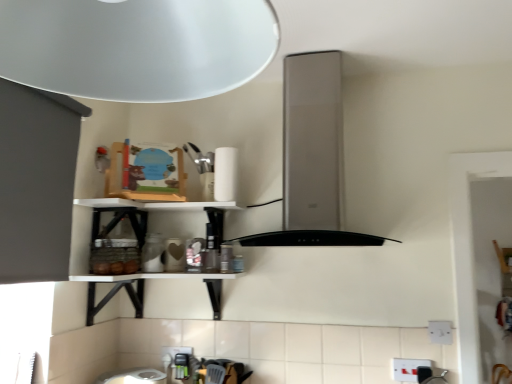
Image resolution: width=512 pixels, height=384 pixels. What do you see at coordinates (407, 368) in the screenshot? I see `white plastic electric outlet at lower right, acting as the second electric outlet starting from the right` at bounding box center [407, 368].

This screenshot has height=384, width=512. Identify the location of white plastic electric outlet at lower center, which is the 3th electric outlet in top-to-bottom order. (175, 352).

Is white matte paper towel at upper center spatially inside white plastic electric outlet at lower right, the 2th electric outlet ordered from the bottom, or outside of it?

white matte paper towel at upper center is located beyond the bounds of white plastic electric outlet at lower right, the 2th electric outlet ordered from the bottom.

Is point (223, 198) positioned before point (398, 363)?

No, it is behind (398, 363).

Based on the photo, considering the relative sizes of white matte paper towel at upper center and white plastic electric outlet at lower right, acting as the second electric outlet starting from the right, in the image provided, is white matte paper towel at upper center shorter than white plastic electric outlet at lower right, acting as the second electric outlet starting from the right,?

In fact, white matte paper towel at upper center may be taller than white plastic electric outlet at lower right, acting as the second electric outlet starting from the right.

From a real-world perspective, is white matte paper towel at upper center positioned over white plastic electric outlet at lower right, positioned as the second electric outlet in top-to-bottom order, based on gravity?

Indeed, from a real-world perspective, white matte paper towel at upper center stands above white plastic electric outlet at lower right, positioned as the second electric outlet in top-to-bottom order.

Which object is further away from the camera, satin silver vent at center or white matte paper towel at upper center?

white matte paper towel at upper center is further from the camera.

Looking at this image, based on their positions, is satin silver vent at center located to the left or right of white matte paper towel at upper center?

Based on their positions, satin silver vent at center is located to the right of white matte paper towel at upper center.

From a real-world perspective, does satin silver vent at center sit lower than white matte paper towel at upper center?

No, from a real-world perspective, satin silver vent at center is not beneath white matte paper towel at upper center.

Considering the points (325, 109) and (214, 181), which point is behind, point (325, 109) or point (214, 181)?

The point (214, 181) is more distant.

Can you tell me how much white plastic electric outlet at lower center, which ranks as the 3th electric outlet in front-to-back order, and white plastic electric outlet at lower right, arranged as the 1th electric outlet when viewed from the top, differ in facing direction?

The angle between the facing direction of white plastic electric outlet at lower center, which ranks as the 3th electric outlet in front-to-back order, and the facing direction of white plastic electric outlet at lower right, arranged as the 1th electric outlet when viewed from the top, is 0.000793 degrees.

Considering the relative sizes of white plastic electric outlet at lower center, which is the 3th electric outlet in top-to-bottom order, and white plastic electric outlet at lower right, the second electric outlet viewed from the back, in the image provided, is white plastic electric outlet at lower center, which is the 3th electric outlet in top-to-bottom order, wider than white plastic electric outlet at lower right, the second electric outlet viewed from the back,?

Incorrect, the width of white plastic electric outlet at lower center, which is the 3th electric outlet in top-to-bottom order, does not surpass that of white plastic electric outlet at lower right, the second electric outlet viewed from the back.

Which is behind, white plastic electric outlet at lower center, placed as the first electric outlet when sorted from left to right, or white plastic electric outlet at lower right, arranged as the 1th electric outlet when viewed from the top?

white plastic electric outlet at lower center, placed as the first electric outlet when sorted from left to right, is further from the camera.

Who is more distant, white matte paper towel at upper center or white plastic electric outlet at lower right, positioned as the 1th electric outlet in right-to-left order?

white matte paper towel at upper center is further from the camera.

Is white matte paper towel at upper center spatially inside white plastic electric outlet at lower right, the second electric outlet viewed from the back, or outside of it?

white matte paper towel at upper center is spatially situated outside white plastic electric outlet at lower right, the second electric outlet viewed from the back.

Which point is more distant from viewer, (x=234, y=173) or (x=451, y=326)?

The point (x=234, y=173) is farther from the camera.

Considering the relative sizes of white plastic electric outlet at lower right, marked as the 2th electric outlet in a left-to-right arrangement, and white plastic electric outlet at lower right, the second electric outlet viewed from the back, in the image provided, is white plastic electric outlet at lower right, marked as the 2th electric outlet in a left-to-right arrangement, thinner than white plastic electric outlet at lower right, the second electric outlet viewed from the back,?

Indeed, white plastic electric outlet at lower right, marked as the 2th electric outlet in a left-to-right arrangement, has a lesser width compared to white plastic electric outlet at lower right, the second electric outlet viewed from the back.

Consider the image. Are white plastic electric outlet at lower right, which ranks as the 1th electric outlet in front-to-back order, and white plastic electric outlet at lower right, the 3th electric outlet when ordered from bottom to top, located far from each other?

white plastic electric outlet at lower right, which ranks as the 1th electric outlet in front-to-back order, is actually quite close to white plastic electric outlet at lower right, the 3th electric outlet when ordered from bottom to top.

Is white plastic electric outlet at lower right, the 2th electric outlet ordered from the bottom, bigger than white plastic electric outlet at lower right, the 3th electric outlet when ordered from bottom to top?

Correct, white plastic electric outlet at lower right, the 2th electric outlet ordered from the bottom, is larger in size than white plastic electric outlet at lower right, the 3th electric outlet when ordered from bottom to top.

From the picture: Do you think white plastic electric outlet at lower right, the 2th electric outlet ordered from the bottom, is within white plastic electric outlet at lower right, the second electric outlet from the front, or outside of it?

white plastic electric outlet at lower right, the 2th electric outlet ordered from the bottom, is located beyond the bounds of white plastic electric outlet at lower right, the second electric outlet from the front.

How much distance is there between white matte paper towel at upper center and white plastic electric outlet at lower center, which ranks as the 3th electric outlet in front-to-back order?

white matte paper towel at upper center is 30.47 inches away from white plastic electric outlet at lower center, which ranks as the 3th electric outlet in front-to-back order.

Considering the positions of point (228, 176) and point (179, 351), is point (228, 176) closer or farther from the camera than point (179, 351)?

Point (228, 176).

Is white matte paper towel at upper center located outside white plastic electric outlet at lower center, which is the 3th electric outlet from right to left?

Yes, white matte paper towel at upper center is outside of white plastic electric outlet at lower center, which is the 3th electric outlet from right to left.

Is white matte paper towel at upper center bigger than white plastic electric outlet at lower center, which ranks as the 3th electric outlet in front-to-back order?

Correct, white matte paper towel at upper center is larger in size than white plastic electric outlet at lower center, which ranks as the 3th electric outlet in front-to-back order.

From the picture: What's the angular difference between white plastic electric outlet at lower center, placed as the first electric outlet when sorted from left to right, and white matte paper towel at upper center's facing directions?

They differ by 2.28 degrees in their facing directions.

Which object is thinner, white plastic electric outlet at lower center, the 1th electric outlet viewed from the back, or white matte paper towel at upper center?

With smaller width is white plastic electric outlet at lower center, the 1th electric outlet viewed from the back.

Is point (165, 360) in front of point (227, 173)?

That is False.

Which of these two, white plastic electric outlet at lower center, the 1th electric outlet viewed from the back, or white matte paper towel at upper center, stands shorter?

white plastic electric outlet at lower center, the 1th electric outlet viewed from the back.

From the image's perspective, count 2nd electric outlets downward from the white matte paper towel at upper center and point to it. Please provide its 2D coordinates.

[(407, 368)]

The image size is (512, 384). I want to click on vent positioned vertically above the white matte paper towel at upper center (from a real-world perspective), so click(312, 157).

Estimate the real-world distances between objects in this image. Which object is closer to white plastic electric outlet at lower center, which is the 3th electric outlet in top-to-bottom order, white matte paper towel at upper center or white plastic electric outlet at lower right, the 2th electric outlet ordered from the bottom?

white matte paper towel at upper center.

From the image, which object appears to be nearer to white plastic electric outlet at lower right, the second electric outlet from the front, white plastic electric outlet at lower right, acting as the second electric outlet starting from the right, or white matte paper towel at upper center?

white plastic electric outlet at lower right, acting as the second electric outlet starting from the right, is positioned closer to the anchor white plastic electric outlet at lower right, the second electric outlet from the front.

Which object lies nearer to the anchor point white plastic electric outlet at lower right, the 2th electric outlet ordered from the bottom, white matte paper towel at upper center or white plastic electric outlet at lower right, the 3th electric outlet when ordered from bottom to top?

The object closer to white plastic electric outlet at lower right, the 2th electric outlet ordered from the bottom, is white plastic electric outlet at lower right, the 3th electric outlet when ordered from bottom to top.

Which object lies nearer to the anchor point white matte paper towel at upper center, white plastic electric outlet at lower right, which ranks as the 1th electric outlet in front-to-back order, or white plastic electric outlet at lower center, placed as the first electric outlet when sorted from left to right?

white plastic electric outlet at lower center, placed as the first electric outlet when sorted from left to right.

Considering their positions, is satin silver vent at center positioned closer to white plastic electric outlet at lower right, the 2th electric outlet ordered from the bottom, than white plastic electric outlet at lower center, which ranks as the 3th electric outlet in front-to-back order?

Based on the image, satin silver vent at center appears to be nearer to white plastic electric outlet at lower right, the 2th electric outlet ordered from the bottom.

Looking at the image, which one is located further to white plastic electric outlet at lower right, the 3th electric outlet when ordered from bottom to top, white plastic electric outlet at lower right, marked as the 2th electric outlet in a left-to-right arrangement, or satin silver vent at center?

satin silver vent at center is positioned further to the anchor white plastic electric outlet at lower right, the 3th electric outlet when ordered from bottom to top.

Estimate the real-world distances between objects in this image. Which object is further from white plastic electric outlet at lower right, acting as the 3th electric outlet starting from the back, white matte paper towel at upper center or white plastic electric outlet at lower center, the 1th electric outlet viewed from the back?

Among the two, white matte paper towel at upper center is located further to white plastic electric outlet at lower right, acting as the 3th electric outlet starting from the back.

From the image, which object appears to be nearer to white plastic electric outlet at lower center, the 1th electric outlet viewed from the back, white plastic electric outlet at lower right, positioned as the 1th electric outlet in right-to-left order, or white plastic electric outlet at lower right, positioned as the second electric outlet in top-to-bottom order?

white plastic electric outlet at lower right, positioned as the second electric outlet in top-to-bottom order, is positioned closer to the anchor white plastic electric outlet at lower center, the 1th electric outlet viewed from the back.

You are a GUI agent. You are given a task and a screenshot of the screen. Output one action in this format:
    pyautogui.click(x=<x>, y=<y>)
    Task: Click on the paper towel between satin silver vent at center and white plastic electric outlet at lower center, which ranks as the 3th electric outlet in front-to-back order, in the up-down direction
    The image size is (512, 384).
    Given the screenshot: What is the action you would take?
    pyautogui.click(x=225, y=174)

Locate an element on the screen. Image resolution: width=512 pixels, height=384 pixels. paper towel between satin silver vent at center and white plastic electric outlet at lower right, which ranks as the 1th electric outlet in front-to-back order, in the vertical direction is located at coordinates (225, 174).

This screenshot has width=512, height=384. I want to click on vent between white matte paper towel at upper center and white plastic electric outlet at lower right, positioned as the 1th electric outlet in right-to-left order, so click(312, 157).

Identify the location of electric outlet between satin silver vent at center and white plastic electric outlet at lower right, the 2th electric outlet ordered from the bottom, in the vertical direction. pos(440,332).